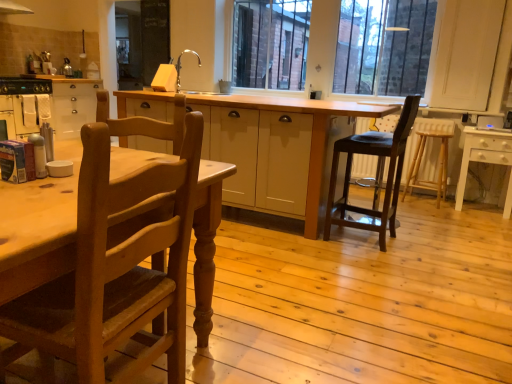
Question: From the image's perspective, is black plastic toaster at upper left over light wood table at center, which is the first table from left to right?

Choices:
 (A) yes
 (B) no

Answer: (A)

Question: Is black plastic toaster at upper left positioned behind light wood table at center, which is the first table from left to right?

Choices:
 (A) yes
 (B) no

Answer: (A)

Question: Is black plastic toaster at upper left touching light wood table at center, which is the first table from left to right?

Choices:
 (A) no
 (B) yes

Answer: (A)

Question: Is black plastic toaster at upper left turned away from light wood table at center, which is the first table from left to right?

Choices:
 (A) yes
 (B) no

Answer: (B)

Question: Does black plastic toaster at upper left have a lesser width compared to light wood table at center, which appears as the 2th table when viewed from the right?

Choices:
 (A) no
 (B) yes

Answer: (B)

Question: Does black plastic toaster at upper left have a smaller size compared to light wood table at center, which is the first table from left to right?

Choices:
 (A) no
 (B) yes

Answer: (B)

Question: Is black plastic toaster at upper left outside dark brown wood stool at center-right, the second chair from the left?

Choices:
 (A) yes
 (B) no

Answer: (A)

Question: From a real-world perspective, is black plastic toaster at upper left positioned over dark brown wood stool at center-right, the second chair from the left, based on gravity?

Choices:
 (A) yes
 (B) no

Answer: (A)

Question: Does black plastic toaster at upper left have a lesser width compared to dark brown wood stool at center-right, the second chair from the left?

Choices:
 (A) yes
 (B) no

Answer: (B)

Question: Is dark brown wood stool at center-right, placed as the 1th chair when sorted from back to front, inside black plastic toaster at upper left?

Choices:
 (A) yes
 (B) no

Answer: (B)

Question: Is there a large distance between black plastic toaster at upper left and dark brown wood stool at center-right, placed as the 1th chair when sorted from back to front?

Choices:
 (A) yes
 (B) no

Answer: (A)

Question: Can you confirm if black plastic toaster at upper left is shorter than dark brown wood stool at center-right, which appears as the second chair when viewed from the front?

Choices:
 (A) no
 (B) yes

Answer: (B)

Question: Can you confirm if metallic silver oven at left is shorter than silver metallic sink at upper center?

Choices:
 (A) no
 (B) yes

Answer: (A)